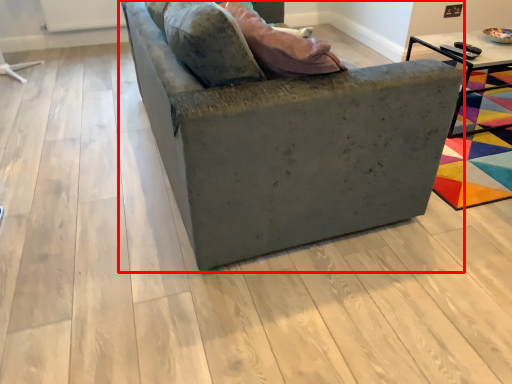
Question: From the image's perspective, where is studio couch (annotated by the red box) located relative to table?

Choices:
 (A) below
 (B) above

Answer: (A)